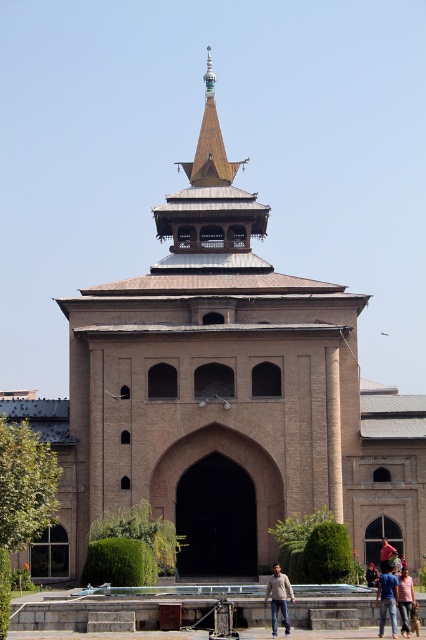
You are standing in front of the grand architectural structure. You notice two points marked on the building. The first point is at coordinates point [382,573] and the second is at point [409,596]. Which point is closer to you?

Point [409,596] is closer to you because it is in front of point [382,573].

You are an architect examining the building and need to determine the placement of these spires. Which spire, the wooden spire at upper center or the shiny copper spire at upper center, is located to the left when viewed from the front?

The wooden spire at upper center is positioned on the left side of the shiny copper spire at upper center, so the wooden spire at upper center is located to the left when viewed from the front.